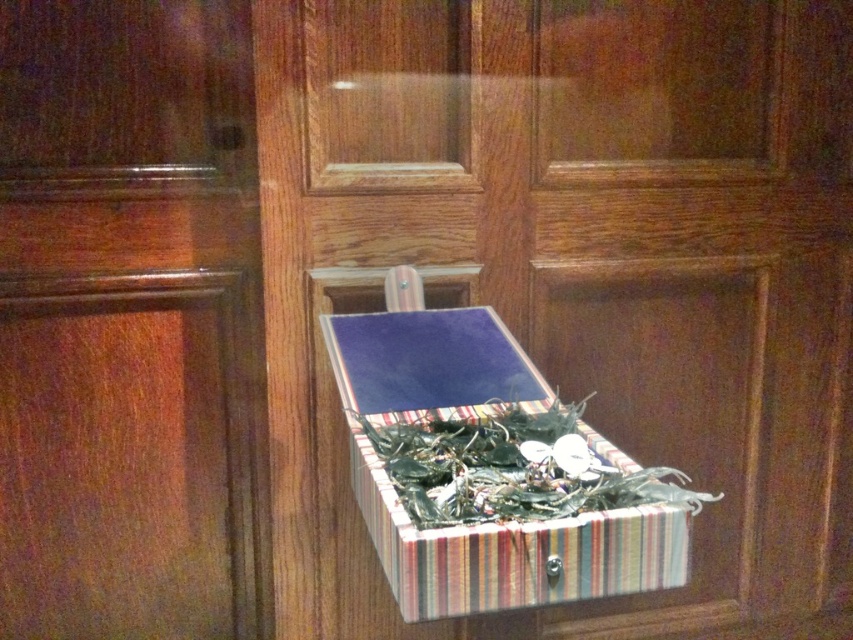
Question: Among these objects, which one is farthest from the camera?

Choices:
 (A) glossy wood door at center
 (B) striped fabric box at center

Answer: (A)

Question: Which point is farther from the camera taking this photo?

Choices:
 (A) (424, 536)
 (B) (715, 449)

Answer: (B)

Question: Does wooden door at center come in front of glossy wood door at center?

Choices:
 (A) no
 (B) yes

Answer: (A)

Question: Which of the following is the farthest from the observer?

Choices:
 (A) pyautogui.click(x=80, y=566)
 (B) pyautogui.click(x=732, y=497)

Answer: (B)

Question: Does wooden door at center appear on the right side of striped fabric box at center?

Choices:
 (A) yes
 (B) no

Answer: (A)

Question: Does wooden door at center have a greater width compared to glossy wood door at center?

Choices:
 (A) no
 (B) yes

Answer: (B)